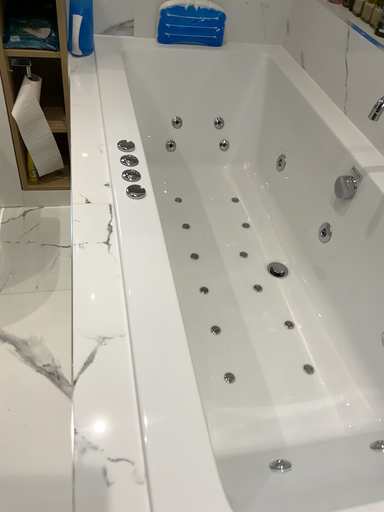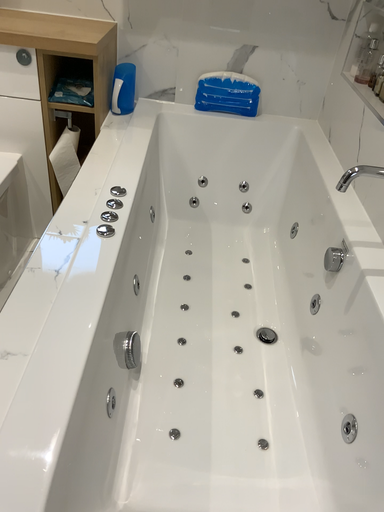
Question: How did the camera likely rotate when shooting the video?

Choices:
 (A) rotated upward
 (B) rotated downward

Answer: (A)